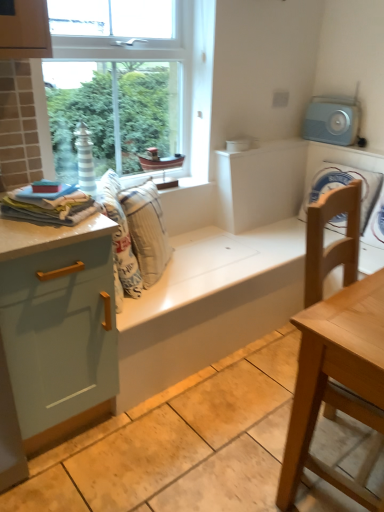
The image size is (384, 512). I want to click on free space in front of soft cotton towels at left, which is the second material from right to left, so click(x=30, y=234).